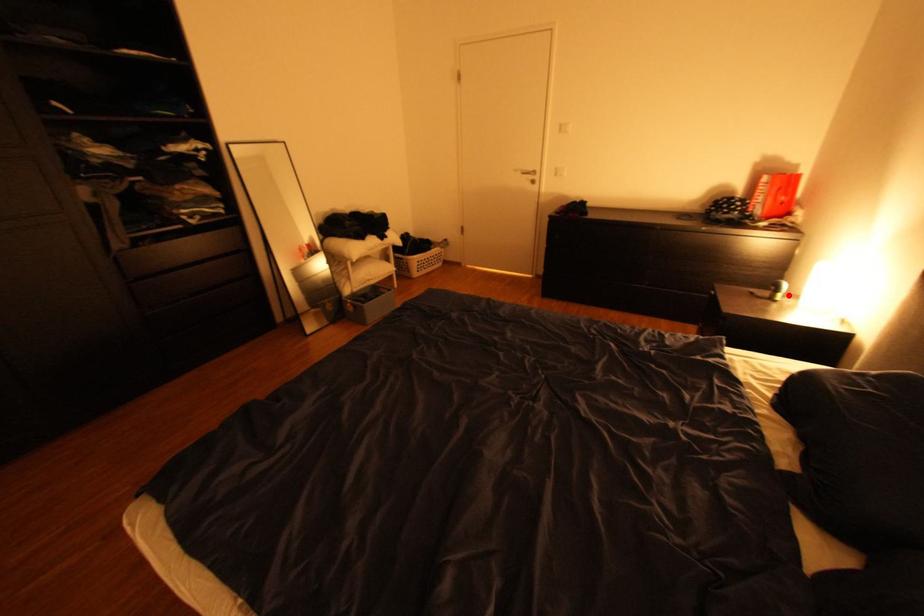
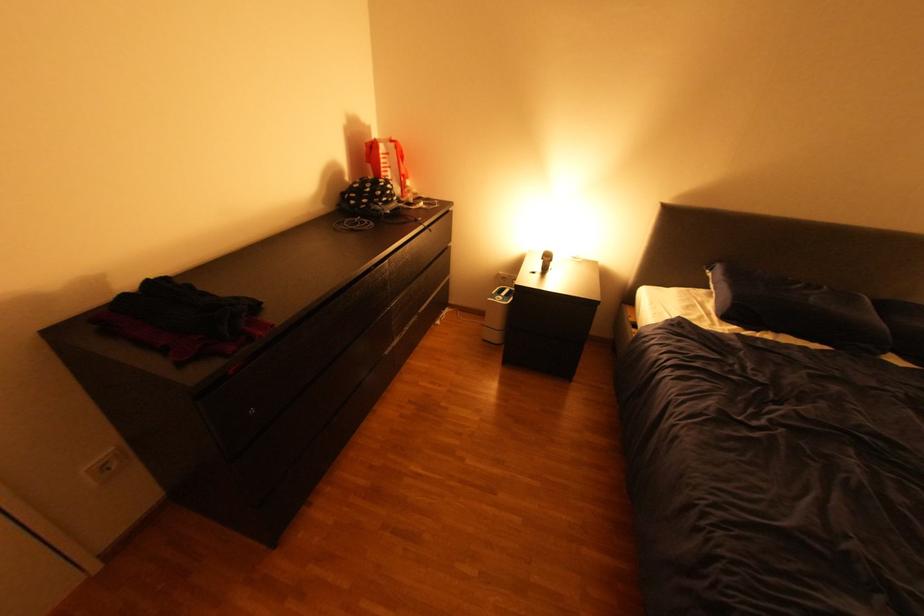
The point at the highlighted location is marked in the first image. Where is the corresponding point in the second image?

(561, 262)